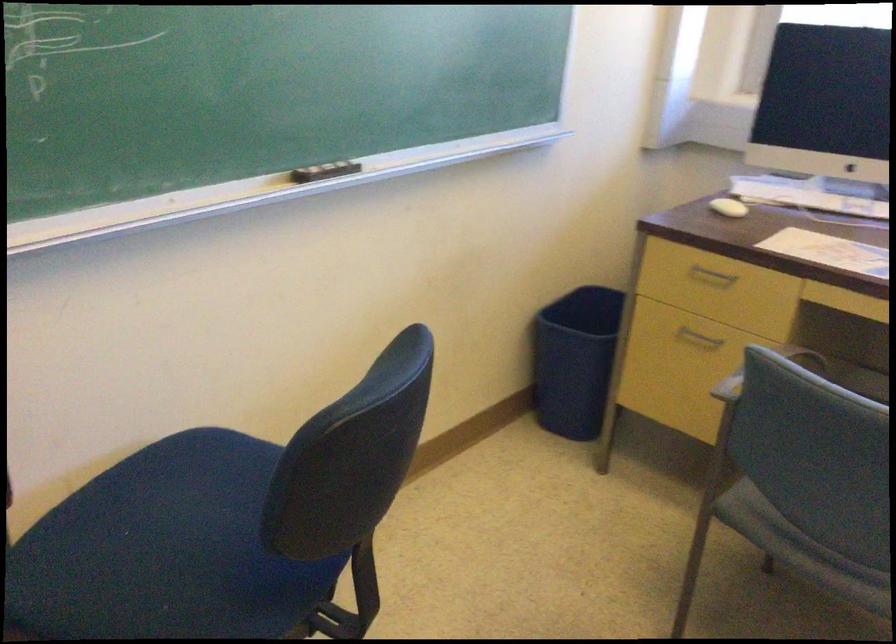
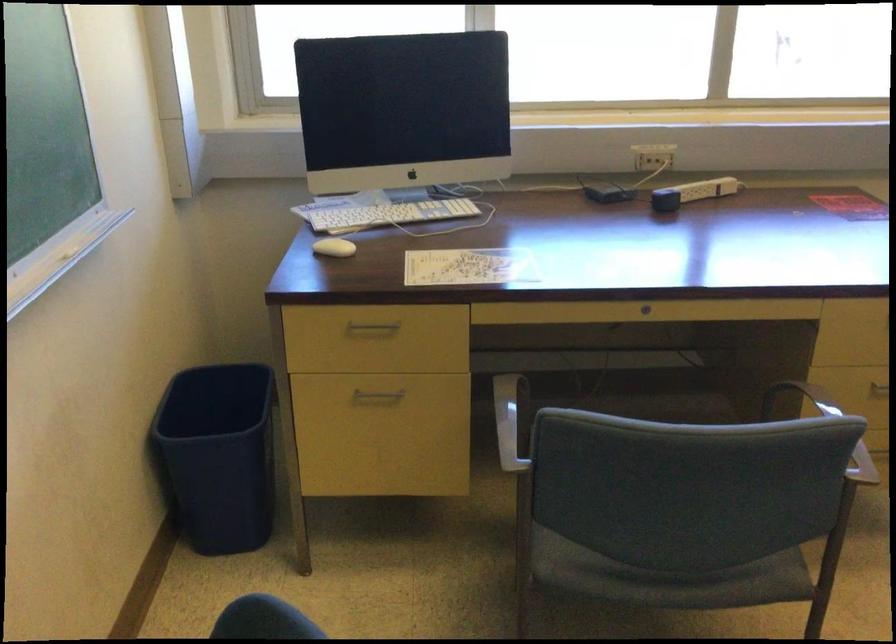
In the second image, find the point that corresponds to pixel 578 345 in the first image.

(217, 456)